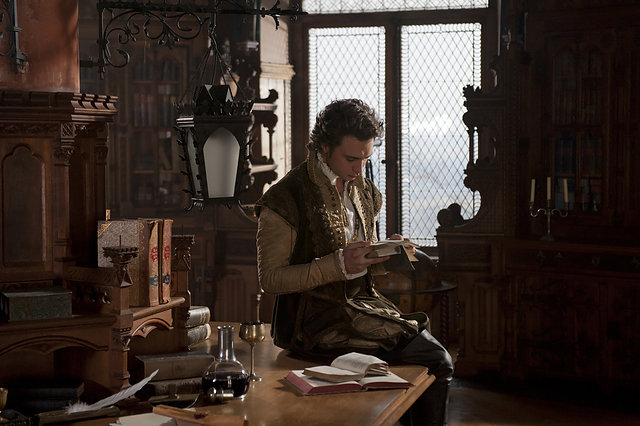
Locate an element on the screen. The image size is (640, 426). floor is located at coordinates (493, 405).